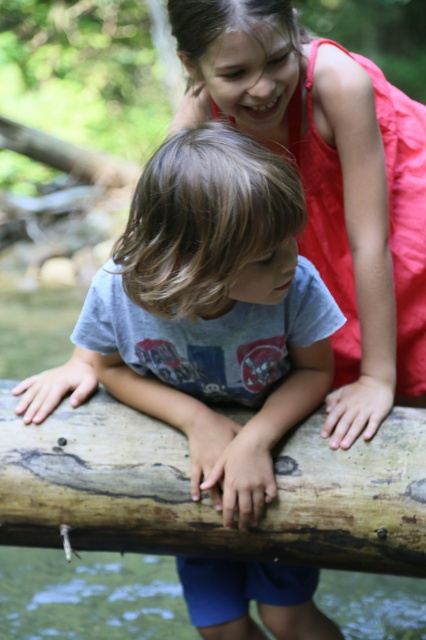
You are a photographer trying to capture a closeup of the child in the foreground. You notice two points marked in the image. Which point, point 1 at coordinates (x=117, y=380) or point 2 at coordinates (x=60, y=627), is closer to you and would allow for a better closeup shot?

Point 1 at coordinates (x=117, y=380) is closer to the camera than point 2 at coordinates (x=60, y=627), so it would be better for a closeup shot.